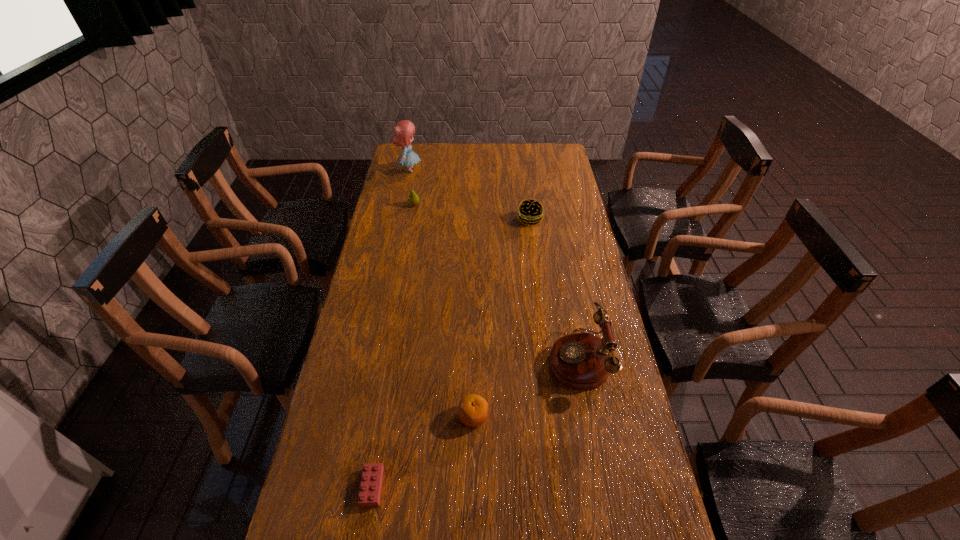
Locate an element on the screen. The width and height of the screenshot is (960, 540). free location located 0.050m on the front-facing side of the doll is located at coordinates (432, 170).

At what (x,y) coordinates should I click in order to perform the action: click on free space located on the dial of the telephone. Please return your answer as a coordinate pair (x, y). This screenshot has width=960, height=540. Looking at the image, I should click on (421, 358).

This screenshot has height=540, width=960. Find the location of `vacant space located on the dial of the telephone`. vacant space located on the dial of the telephone is located at coordinates (470, 358).

The height and width of the screenshot is (540, 960). In order to click on blank space located 0.060m on the dial of the telephone in this screenshot , I will do `click(529, 358)`.

You are a GUI agent. You are given a task and a screenshot of the screen. Output one action in this format:
    pyautogui.click(x=<x>, y=<y>)
    Task: Click on the free space located on the right of the fifth nearest object
    This screenshot has height=540, width=960.
    Given the screenshot: What is the action you would take?
    pyautogui.click(x=447, y=205)

Identify the location of free region located 0.060m on the front of the patty. (532, 237).

You are a GUI agent. You are given a task and a screenshot of the screen. Output one action in this format:
    pyautogui.click(x=<x>, y=<y>)
    Task: Click on the vacant space located 0.250m on the back of the fifth farthest object
    The image size is (960, 540).
    Given the screenshot: What is the action you would take?
    pyautogui.click(x=474, y=332)

The height and width of the screenshot is (540, 960). Identify the location of free space located on the back of the Lego. (388, 394).

Identify the location of object positioned at the far edge. Image resolution: width=960 pixels, height=540 pixels. (403, 131).

Where is `doll that is at the left edge`? doll that is at the left edge is located at coordinates (403, 131).